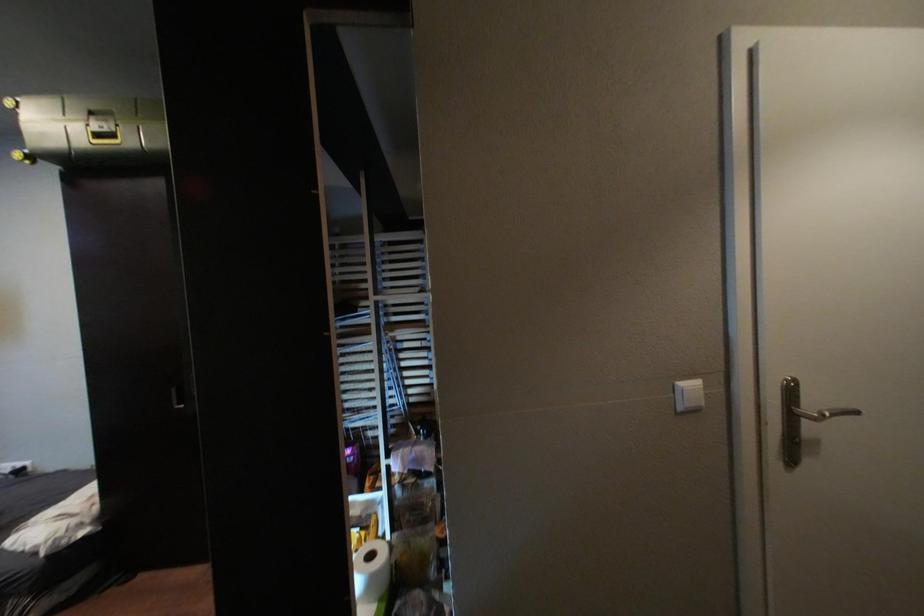
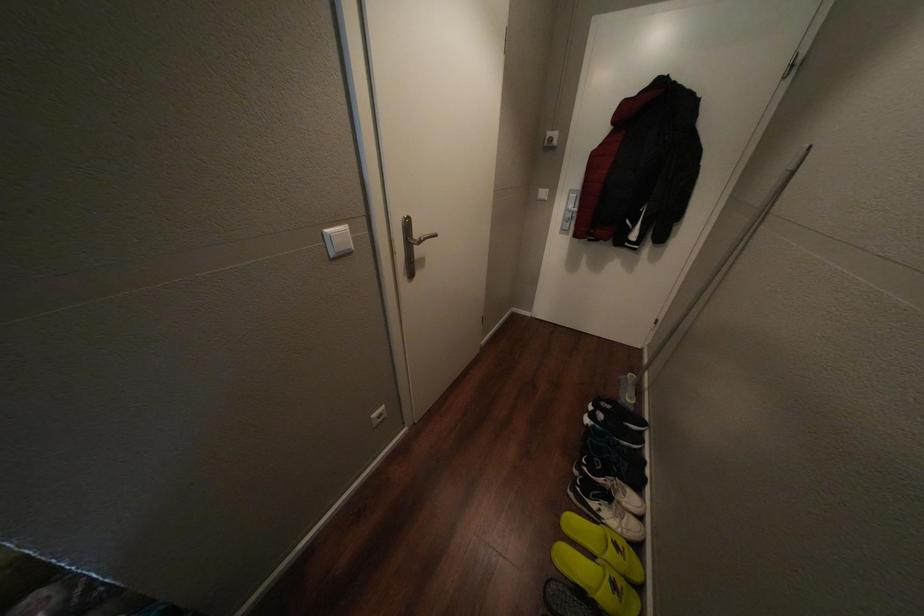
First-person continuous shooting, in which direction is the camera rotating?

The camera's rotation is toward right-down.